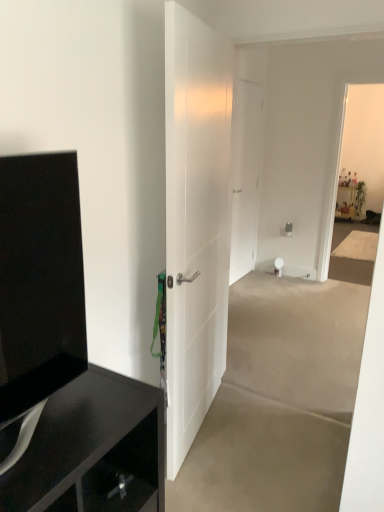
Question: Is black glossy tv cabinet at left taller or shorter than black glossy cabinet at left?

Choices:
 (A) tall
 (B) short

Answer: (B)

Question: In terms of width, does black glossy tv cabinet at left look wider or thinner when compared to black glossy cabinet at left?

Choices:
 (A) wide
 (B) thin

Answer: (B)

Question: Estimate the real-world distances between objects in this image. Which object is farther from the white matte door at center, which is the second door from left to right?

Choices:
 (A) black glossy tv cabinet at left
 (B) black glossy cabinet at left
 (C) white smooth door at center, which is the 2th door in back-to-front order

Answer: (A)

Question: Which is nearer to the white smooth door at center, the first door positioned from the front?

Choices:
 (A) white matte door at center, which is counted as the 2th door, starting from the front
 (B) black glossy cabinet at left
 (C) black glossy tv cabinet at left

Answer: (B)